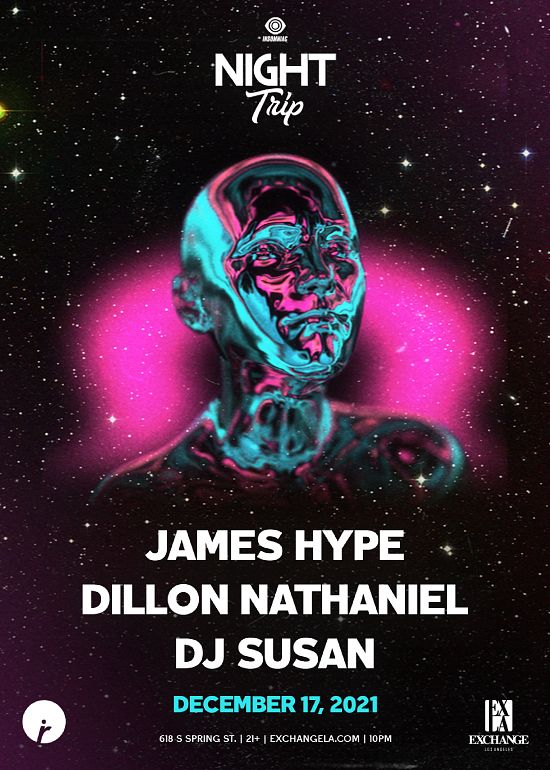
This screenshot has height=770, width=550. Identify the location of event poster. (444, 45).